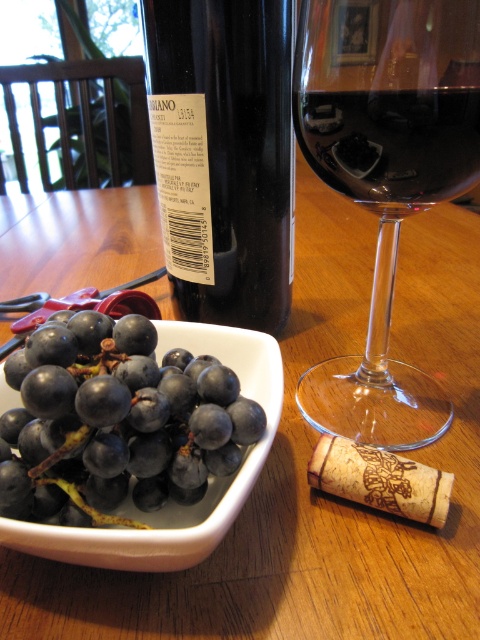
You are standing in front of the wooden table and want to place a small ornament exactly at the point marked by coordinates (228, 154). Which object on the table should you be cautious not to knock over while placing the ornament?

The point marked by coordinates (228, 154) is on the black glass bottle at center, so you should be cautious not to knock over the black glass bottle at center while placing the ornament.

You are pouring wine from the black glass bottle at center into the dark red liquid at center. Is the bottle above or below the liquid?

The black glass bottle at center is positioned over dark red liquid at center, so the bottle is above the liquid.